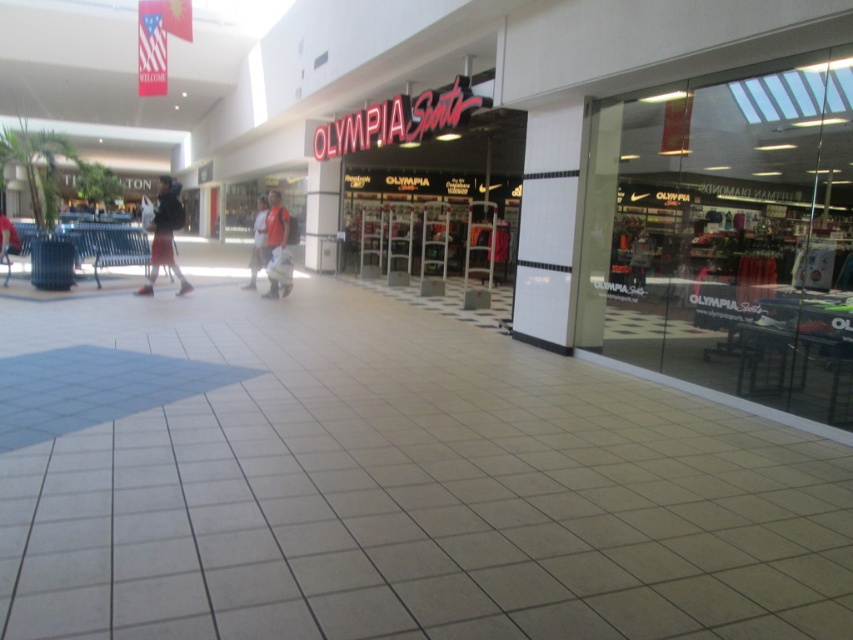
Locate an element on the screen. The width and height of the screenshot is (853, 640). dark gray backpack at center is located at coordinates (165, 236).

Between dark gray backpack at center and red shirt at center, which one has less height?

red shirt at center is shorter.

Does point (183, 209) lie in front of point (274, 230)?

Yes, point (183, 209) is closer to viewer.

At what (x,y) coordinates should I click in order to perform the action: click on dark gray backpack at center. Please return your answer as a coordinate pair (x, y). This screenshot has width=853, height=640. Looking at the image, I should click on (165, 236).

Between dark gray backpack at center and reddish-brown fabric pants at center, which one appears on the left side from the viewer's perspective?

dark gray backpack at center is more to the left.

Who is more forward, (183, 220) or (263, 230)?

Point (183, 220) is in front.

At what (x,y) coordinates should I click in order to perform the action: click on dark gray backpack at center. Please return your answer as a coordinate pair (x, y). The width and height of the screenshot is (853, 640). Looking at the image, I should click on (165, 236).

Between red shirt at center and reddish-brown fabric pants at center, which one appears on the right side from the viewer's perspective?

Positioned to the right is red shirt at center.

Which is above, red shirt at center or reddish-brown fabric pants at center?

red shirt at center is higher up.

What do you see at coordinates (276, 224) in the screenshot? I see `red shirt at center` at bounding box center [276, 224].

Locate an element on the screen. The height and width of the screenshot is (640, 853). red shirt at center is located at coordinates (276, 224).